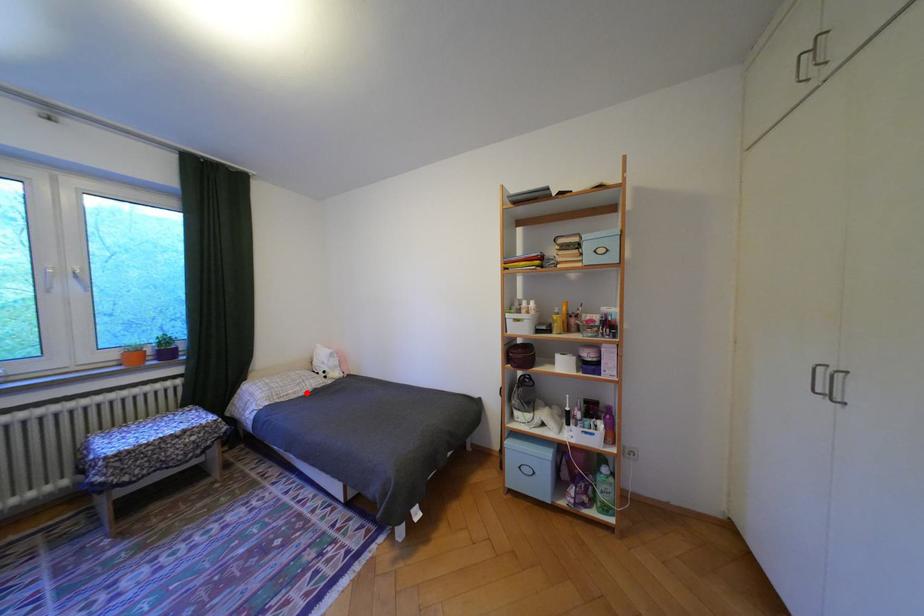
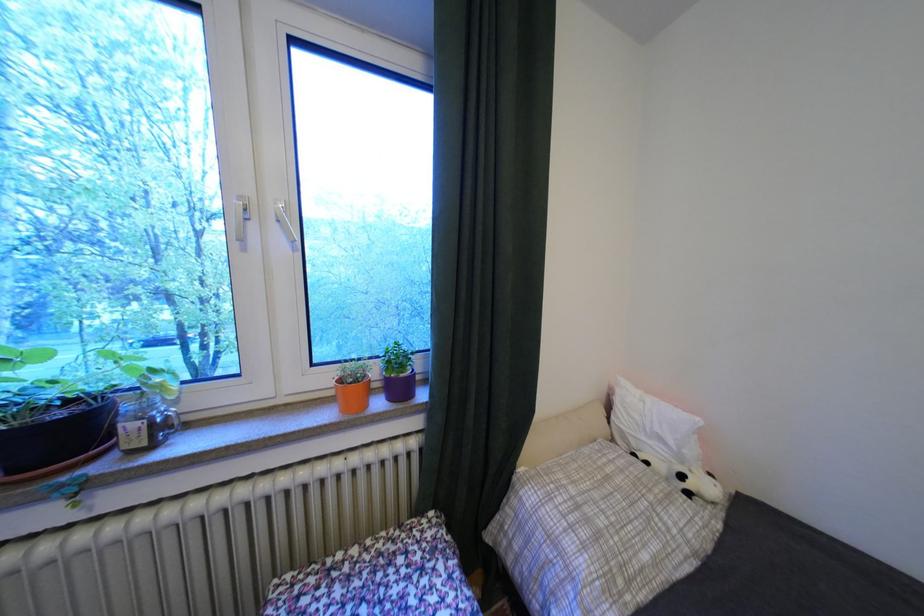
Question: I am providing you with two images of the same scene from different viewpoints. Image1 has a red point marked. In image2, the corresponding 3D location appears at what relative position? Reply with the corresponding letter.

Choices:
 (A) Closer
 (B) Farther

Answer: (A)